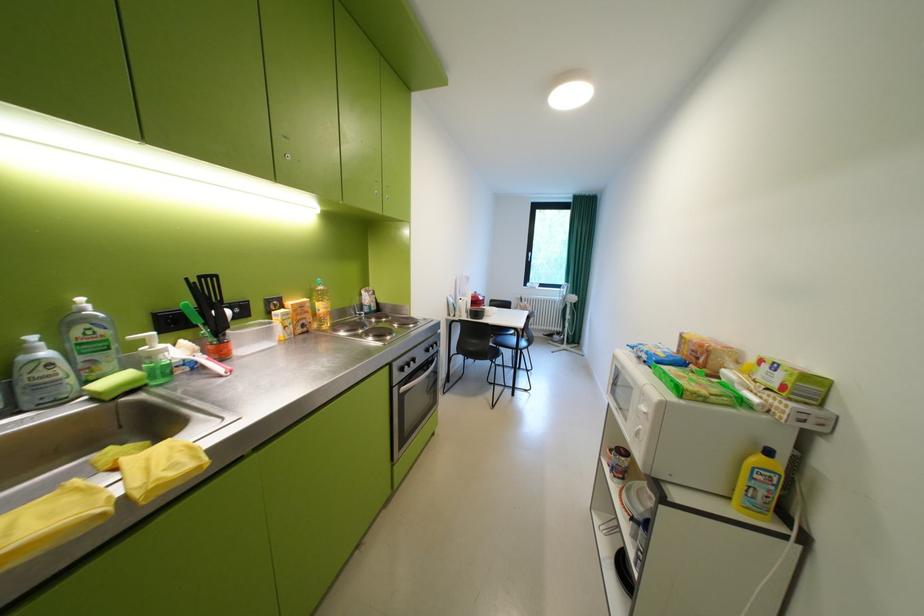
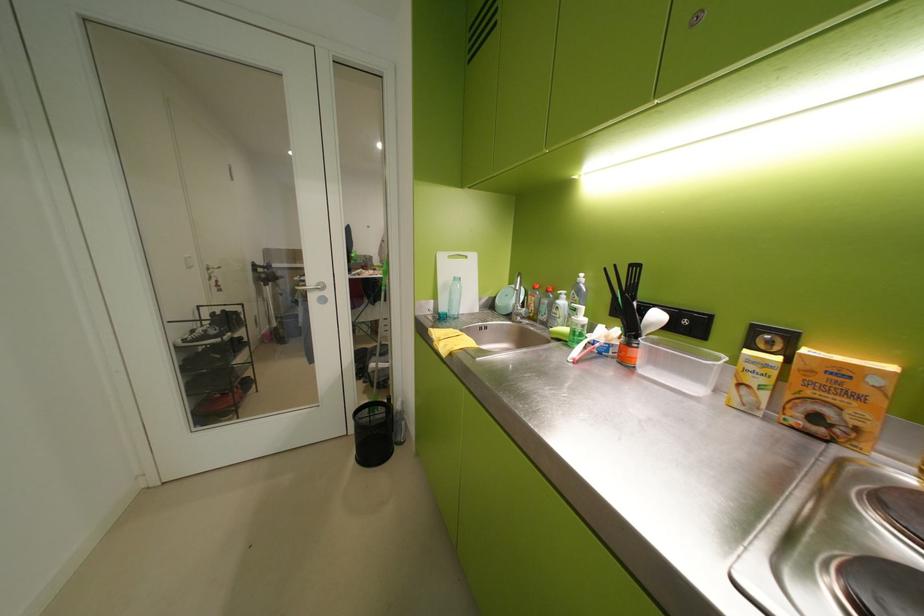
Find the pixel in the second image that matches pixel 244 345 in the first image.

(650, 354)